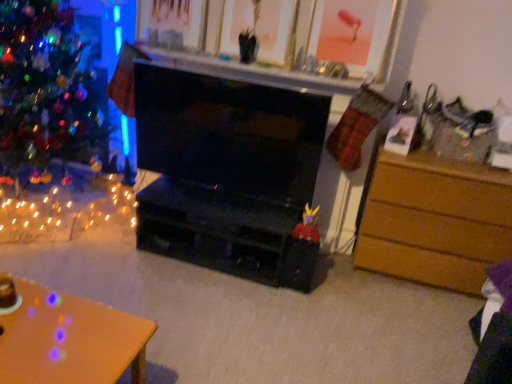
You are a GUI agent. You are given a task and a screenshot of the screen. Output one action in this format:
    pyautogui.click(x=<x>, y=<y>)
    Task: Click on the vacant space situated on the left part of brown wooden chest of drawers at right
    
    Given the screenshot: What is the action you would take?
    pyautogui.click(x=341, y=284)